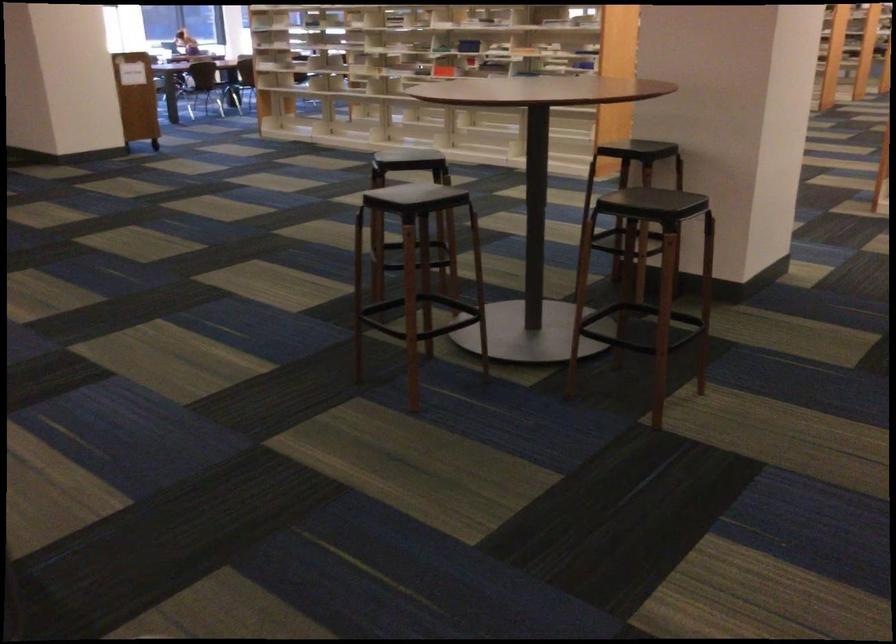
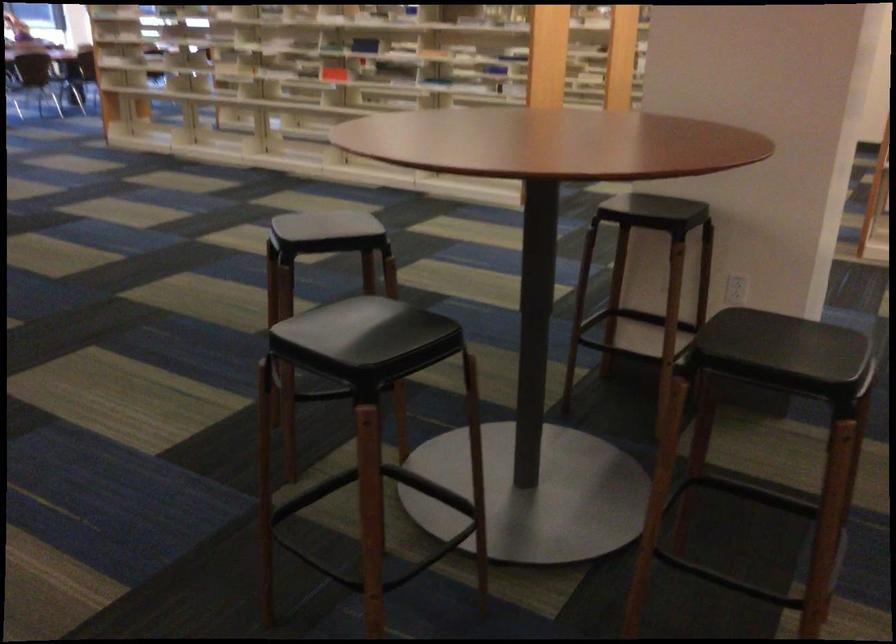
Question: What movement of the cameraman would produce the second image?

Choices:
 (A) Left
 (B) Right
 (C) Forward
 (D) Backward

Answer: (C)